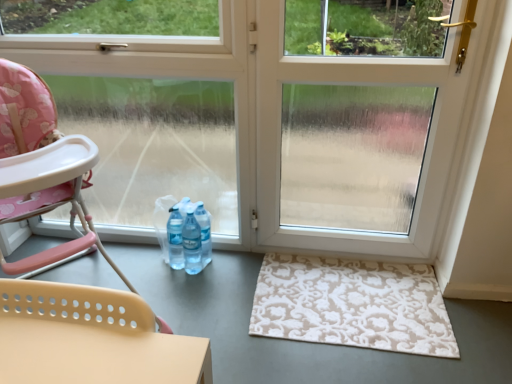
What do you see at coordinates (356, 124) in the screenshot? I see `transparent plastic screen door at center` at bounding box center [356, 124].

At what (x,y) coordinates should I click in order to perform the action: click on transparent plastic screen door at center. Please return your answer as a coordinate pair (x, y). The image size is (512, 384). Looking at the image, I should click on (356, 124).

What do you see at coordinates (70, 226) in the screenshot? This screenshot has height=384, width=512. I see `pink fabric highchair at left` at bounding box center [70, 226].

What are the coordinates of `clear glass window at left` in the screenshot? It's located at (154, 144).

Identify the location of doormat beneath the pink fabric highchair at left (from a real-world perspective). The image size is (512, 384). (352, 304).

Based on the photo, is pink fabric highchair at left to the left or to the right of beige floral rug at lower right in the image?

From the image, it's evident that pink fabric highchair at left is to the left of beige floral rug at lower right.

Is pink fabric highchair at left looking in the opposite direction of beige floral rug at lower right?

No, pink fabric highchair at left is not facing the opposite direction of beige floral rug at lower right.

From their relative heights in the image, would you say pink fabric highchair at left is taller or shorter than beige floral rug at lower right?

pink fabric highchair at left is taller than beige floral rug at lower right.

At what (x,y) coordinates should I click in order to perform the action: click on window screen below the transparent plastic screen door at center (from a real-world perspective). Please return your answer as a coordinate pair (x, y). The image size is (512, 384). Looking at the image, I should click on (154, 144).

Between clear glass window at left and transparent plastic screen door at center, which one has smaller width?

transparent plastic screen door at center.

How far apart are clear glass window at left and transparent plastic screen door at center?

clear glass window at left and transparent plastic screen door at center are 28.32 inches apart.

Is transparent plastic screen door at center taller or shorter than clear glass window at left?

Clearly, transparent plastic screen door at center is shorter compared to clear glass window at left.

Which object is wider, transparent plastic screen door at center or clear glass window at left?

Wider between the two is clear glass window at left.

Based on the photo, in the image, is transparent plastic screen door at center positioned in front of or behind clear glass window at left?

Clearly, transparent plastic screen door at center is in front of clear glass window at left.

From the image's perspective, would you say transparent plastic screen door at center is positioned over clear glass window at left?

Actually, transparent plastic screen door at center appears below clear glass window at left in the image.

From a real-world perspective, between clear glass window at left and pink fabric highchair at left, who is vertically lower?

pink fabric highchair at left, from a real-world perspective.

Which is behind, point (105, 199) or point (72, 220)?

The point (105, 199) is behind.

From the image's perspective, is clear glass window at left positioned above or below pink fabric highchair at left?

Based on their image positions, clear glass window at left is located above pink fabric highchair at left.

Between clear glass window at left and pink fabric highchair at left, which one has larger width?

pink fabric highchair at left.

Is transparent plastic screen door at center far from pink fabric highchair at left?

They are positioned close to each other.

In the scene shown: Which of these two, transparent plastic screen door at center or pink fabric highchair at left, is wider?

pink fabric highchair at left.

From the picture: Considering the sizes of objects transparent plastic screen door at center and pink fabric highchair at left in the image provided, who is taller, transparent plastic screen door at center or pink fabric highchair at left?

With more height is transparent plastic screen door at center.

Which object is more forward, beige floral rug at lower right or transparent plastic screen door at center?

transparent plastic screen door at center.

From the image's perspective, is beige floral rug at lower right on transparent plastic screen door at center?

Incorrect, from the image's perspective, beige floral rug at lower right is lower than transparent plastic screen door at center.

Between beige floral rug at lower right and transparent plastic screen door at center, which one has more height?

transparent plastic screen door at center.

From a real-world perspective, is beige floral rug at lower right positioned above or below transparent plastic screen door at center?

Clearly, from a real-world perspective, beige floral rug at lower right is below transparent plastic screen door at center.

How many degrees apart are the facing directions of clear glass window at left and beige floral rug at lower right?

There is a 0.000335-degree angle between the facing directions of clear glass window at left and beige floral rug at lower right.

In the image, is clear glass window at left positioned in front of or behind beige floral rug at lower right?

clear glass window at left is in front of beige floral rug at lower right.

From the image's perspective, which is below, clear glass window at left or beige floral rug at lower right?

beige floral rug at lower right is shown below in the image.

Considering the relative sizes of clear glass window at left and beige floral rug at lower right in the image provided, is clear glass window at left shorter than beige floral rug at lower right?

No, clear glass window at left is not shorter than beige floral rug at lower right.

At what (x,y) coordinates should I click in order to perform the action: click on doormat on the right of the pink fabric highchair at left. Please return your answer as a coordinate pair (x, y). Looking at the image, I should click on (x=352, y=304).

Where is `screen door below the clear glass window at left (from the image's perspective)`? The height and width of the screenshot is (384, 512). screen door below the clear glass window at left (from the image's perspective) is located at coordinates point(356,124).

Estimate the real-world distances between objects in this image. Which object is closer to beige floral rug at lower right, transparent plastic screen door at center or pink fabric highchair at left?

transparent plastic screen door at center lies closer to beige floral rug at lower right than the other object.

Which object lies nearer to the anchor point clear glass window at left, transparent plastic screen door at center or beige floral rug at lower right?

The object closer to clear glass window at left is transparent plastic screen door at center.

In the scene shown: From the image, which object appears to be farther from transparent plastic screen door at center, pink fabric highchair at left or clear glass window at left?

pink fabric highchair at left is further to transparent plastic screen door at center.

Which object lies further to the anchor point transparent plastic screen door at center, pink fabric highchair at left or beige floral rug at lower right?

pink fabric highchair at left.

Estimate the real-world distances between objects in this image. Which object is further from beige floral rug at lower right, pink fabric highchair at left or transparent plastic screen door at center?

The object further to beige floral rug at lower right is pink fabric highchair at left.

From the image, which object appears to be nearer to pink fabric highchair at left, clear glass window at left or beige floral rug at lower right?

Among the two, clear glass window at left is located nearer to pink fabric highchair at left.

Based on their spatial positions, is beige floral rug at lower right or transparent plastic screen door at center closer to pink fabric highchair at left?

beige floral rug at lower right is positioned closer to the anchor pink fabric highchair at left.

Estimate the real-world distances between objects in this image. Which object is further from pink fabric highchair at left, transparent plastic screen door at center or beige floral rug at lower right?

transparent plastic screen door at center is positioned further to the anchor pink fabric highchair at left.

At what (x,y) coordinates should I click in order to perform the action: click on window screen between pink fabric highchair at left and transparent plastic screen door at center in the horizontal direction. Please return your answer as a coordinate pair (x, y). Looking at the image, I should click on (154, 144).

In order to click on window screen between pink fabric highchair at left and beige floral rug at lower right in the horizontal direction in this screenshot , I will do `click(154, 144)`.

Identify the location of doormat located between clear glass window at left and transparent plastic screen door at center in the left-right direction. (352, 304).

This screenshot has width=512, height=384. I want to click on doormat between pink fabric highchair at left and transparent plastic screen door at center, so click(x=352, y=304).